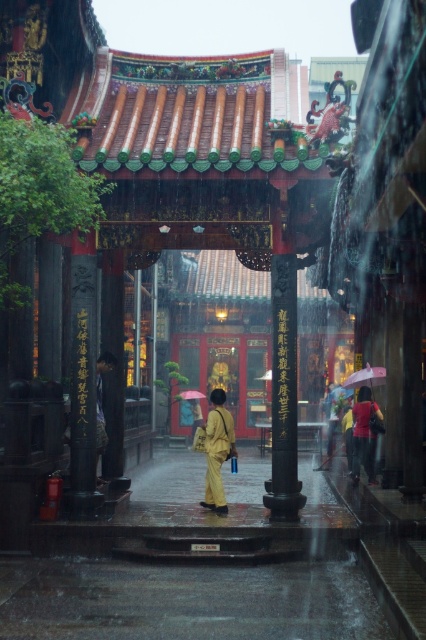
Question: Does yellow fabric umbrella at center appear under red matte umbrella at center?

Choices:
 (A) yes
 (B) no

Answer: (A)

Question: Among these objects, which one is farthest from the camera?

Choices:
 (A) pink matte umbrella at center
 (B) yellow matte dress at center
 (C) red matte umbrella at center
 (D) yellow fabric umbrella at center

Answer: (C)

Question: Can you confirm if yellow matte dress at center is positioned below red matte umbrella at center?

Choices:
 (A) no
 (B) yes

Answer: (A)

Question: Does pink matte umbrella at center appear over red matte umbrella at center?

Choices:
 (A) yes
 (B) no

Answer: (A)

Question: Which object appears farthest from the camera in this image?

Choices:
 (A) red matte umbrella at center
 (B) pink matte umbrella at center
 (C) yellow fabric umbrella at center
 (D) yellow matte dress at center

Answer: (A)

Question: Among these points, which one is farthest from the camera?

Choices:
 (A) (215, 401)
 (B) (198, 396)
 (C) (345, 385)

Answer: (B)